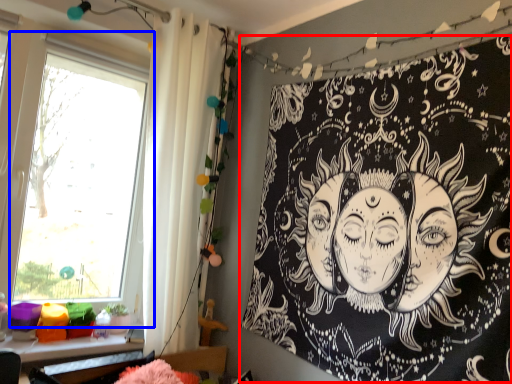
Question: Among these objects, which one is nearest to the camera, bulletin board (highlighted by a red box) or window (highlighted by a blue box)?

Choices:
 (A) bulletin board
 (B) window

Answer: (A)